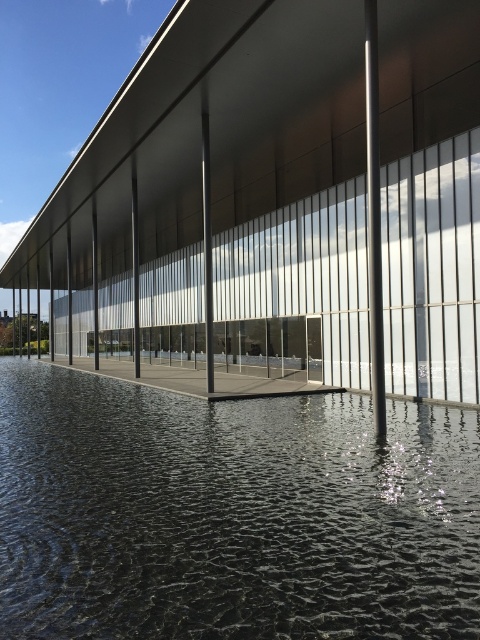
Measure the distance from black reflective water at center to polished metal pole at center.

black reflective water at center and polished metal pole at center are 4.56 meters apart from each other.

Which of these two, black reflective water at center or polished metal pole at center, stands taller?

With more height is polished metal pole at center.

Is point (319, 468) farther from viewer compared to point (368, 49)?

No, it is not.

What are the coordinates of `black reflective water at center` in the screenshot? It's located at (231, 515).